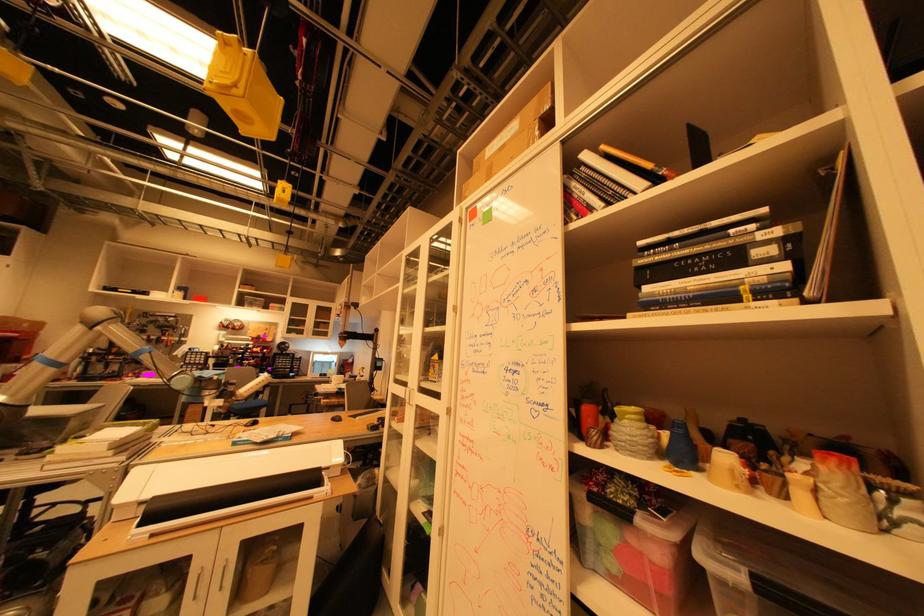
Where is `black bin latch`? black bin latch is located at coordinates (363, 349).